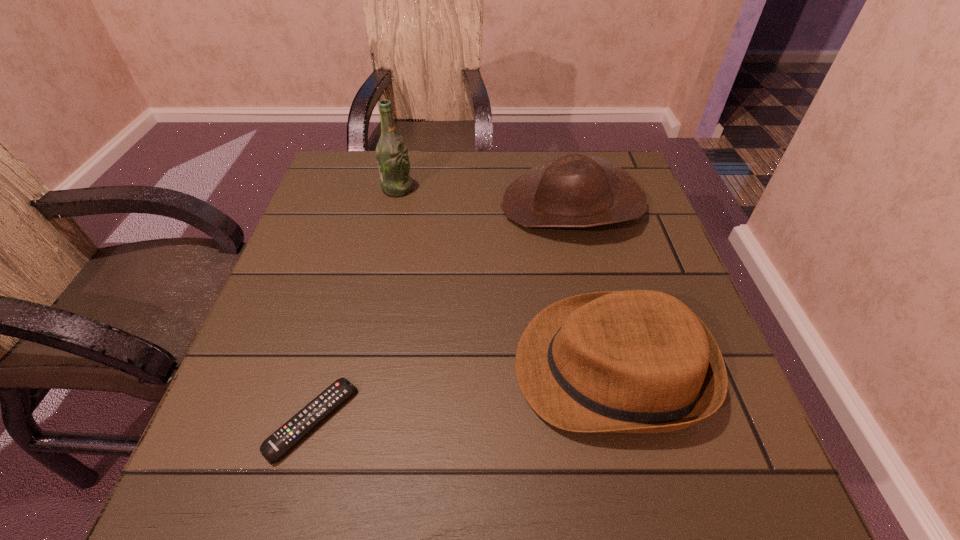
At what (x,y) coordinates should I click in order to perform the action: click on free space at the far edge of the desktop. Please return your answer as a coordinate pair (x, y). This screenshot has height=540, width=960. Looking at the image, I should click on (465, 164).

Find the location of a particular element. blank space at the near edge of the desktop is located at coordinates (631, 493).

Identify the location of vacant position at the left edge of the desktop. The image size is (960, 540). (326, 257).

Where is `vacant area at the right edge of the desktop`? The width and height of the screenshot is (960, 540). vacant area at the right edge of the desktop is located at coordinates (625, 276).

Where is `vacant space at the near left corner`? vacant space at the near left corner is located at coordinates (209, 498).

Locate an element on the screen. free spot at the near right corner of the desktop is located at coordinates (765, 474).

This screenshot has height=540, width=960. I want to click on empty space that is in between the cowboy hat and the tallest object, so click(485, 197).

This screenshot has height=540, width=960. In order to click on free space that is in between the fedora and the remote control in this screenshot , I will do `click(462, 394)`.

What are the coordinates of `blank region between the shortest object and the fedora` in the screenshot? It's located at (462, 394).

Where is `unoccupied area between the cowboy hat and the remote control`? This screenshot has width=960, height=540. unoccupied area between the cowboy hat and the remote control is located at coordinates (443, 313).